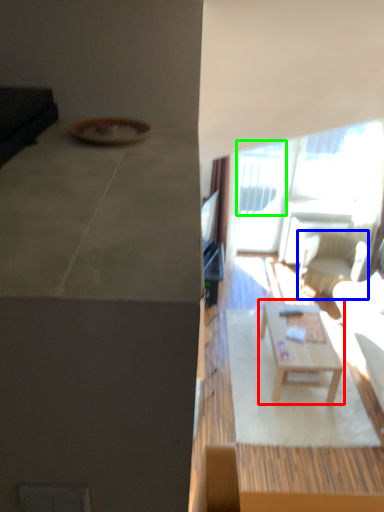
Question: Which is nearer to the coffee table (highlighted by a red box)? chair (highlighted by a blue box) or window (highlighted by a green box).

Choices:
 (A) chair
 (B) window

Answer: (A)